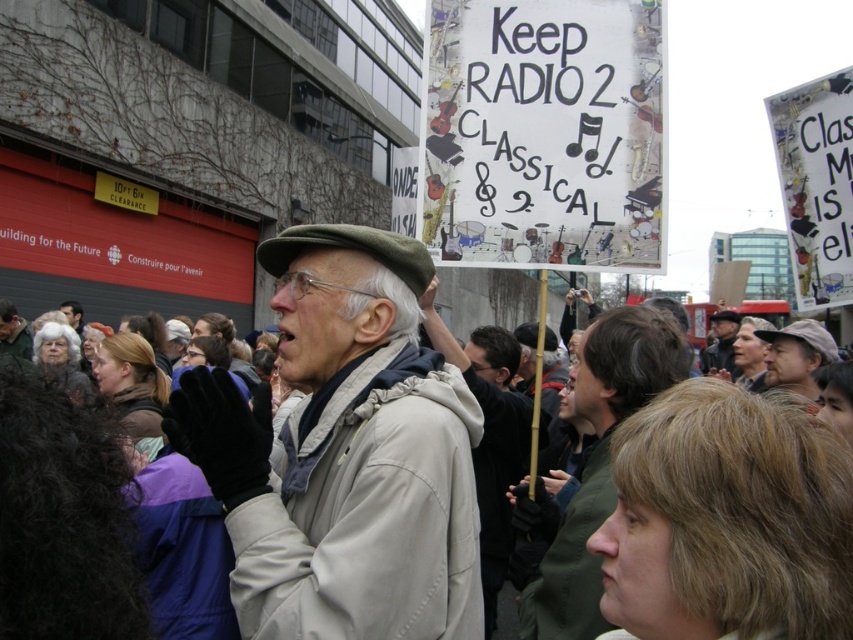
Question: Does dark brown leather jacket at center appear under light brown leather jacket at center?

Choices:
 (A) yes
 (B) no

Answer: (A)

Question: Does light beige jacket at center appear under dark brown leather jacket at center?

Choices:
 (A) yes
 (B) no

Answer: (B)

Question: Among these objects, which one is nearest to the camera?

Choices:
 (A) dark brown leather jacket at center
 (B) dark gray knit cap at upper center
 (C) light beige jacket at center

Answer: (C)

Question: Is dark brown leather jacket at center bigger than light brown leather jacket at center?

Choices:
 (A) yes
 (B) no

Answer: (A)

Question: Which point is closer to the camera?

Choices:
 (A) (618, 364)
 (B) (432, 433)

Answer: (B)

Question: Which of the following is the closest to the observer?

Choices:
 (A) light brown leather jacket at center
 (B) dark gray knit cap at upper center
 (C) brown leather cap at upper right

Answer: (C)